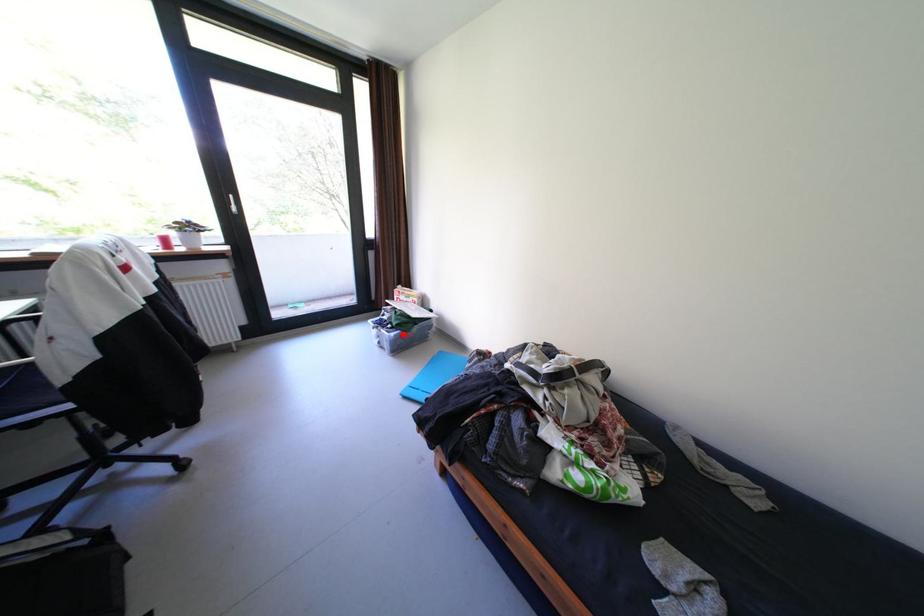
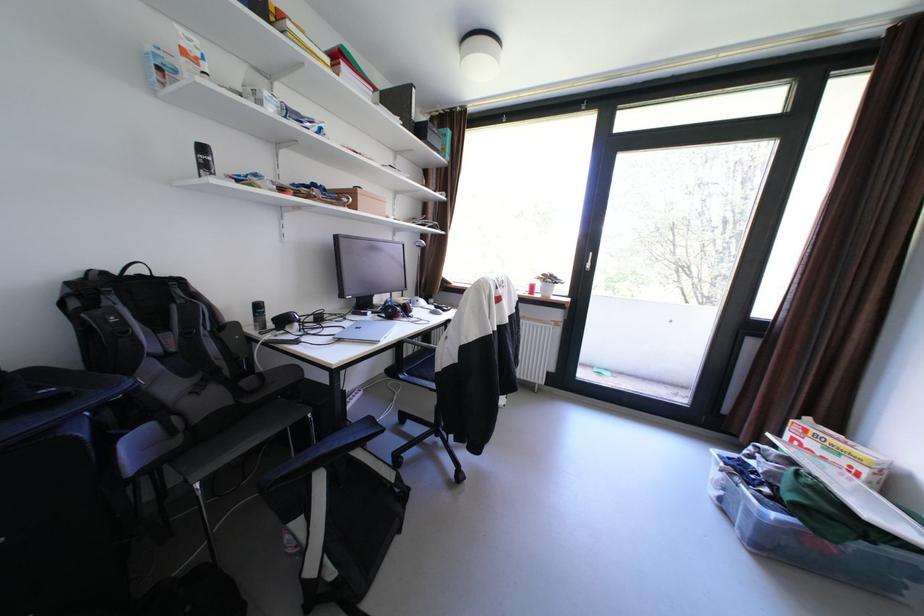
Question: I am providing you with two images of the same scene from different viewpoints. Image1 has a red point marked. In image2, the corresponding 3D location appears at what relative position? Reply with the corresponding letter.

Choices:
 (A) Closer
 (B) Farther

Answer: (A)